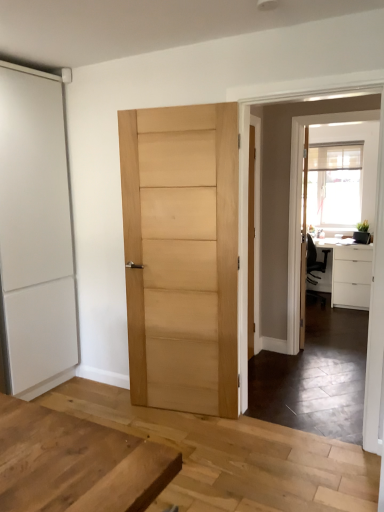
The image size is (384, 512). I want to click on vacant area situated to the left side of clear glass screen door at upper right, so click(297, 365).